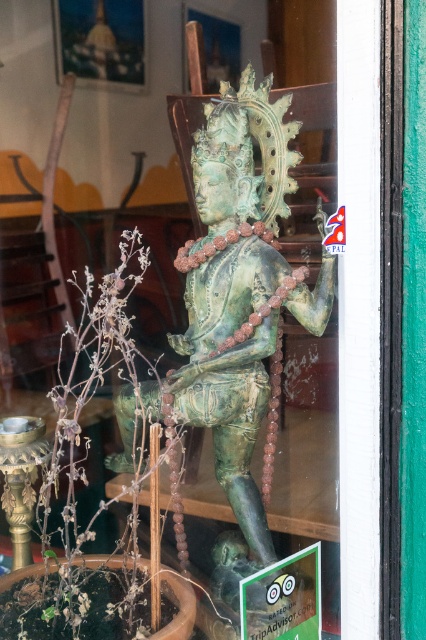
Can you confirm if green patina statue at center is bigger than green leafy plant at center?

Incorrect, green patina statue at center is not larger than green leafy plant at center.

Describe the element at coordinates (235, 285) in the screenshot. I see `green patina statue at center` at that location.

This screenshot has width=426, height=640. Identify the location of green patina statue at center. (235, 285).